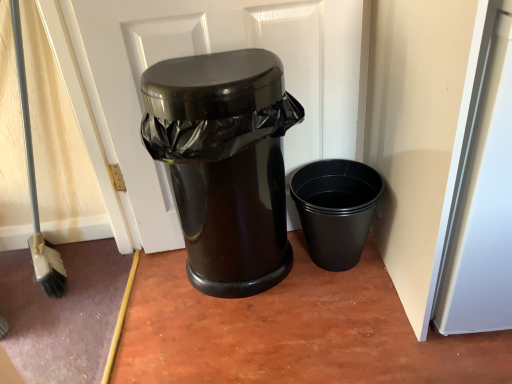
Question: In the image, is black matte plastic cup at right, positioned as the second waste container in left-to-right order, on the left side or the right side of glossy black trash can at center?

Choices:
 (A) left
 (B) right

Answer: (B)

Question: In the image, is black matte plastic cup at right, positioned as the second waste container in left-to-right order, positioned in front of or behind glossy black trash can at center?

Choices:
 (A) front
 (B) behind

Answer: (B)

Question: Which object is the farthest from the glossy black trash can at center, which is the 1th waste container in left-to-right order?

Choices:
 (A) black matte plastic cup at right, positioned as the second waste container in left-to-right order
 (B) glossy black trash can at center

Answer: (A)

Question: Considering the real-world distances, which object is closest to the glossy black trash can at center?

Choices:
 (A) glossy black trash can at center, which ranks as the 2th waste container in right-to-left order
 (B) black matte plastic cup at right, placed as the 1th waste container when sorted from right to left

Answer: (A)